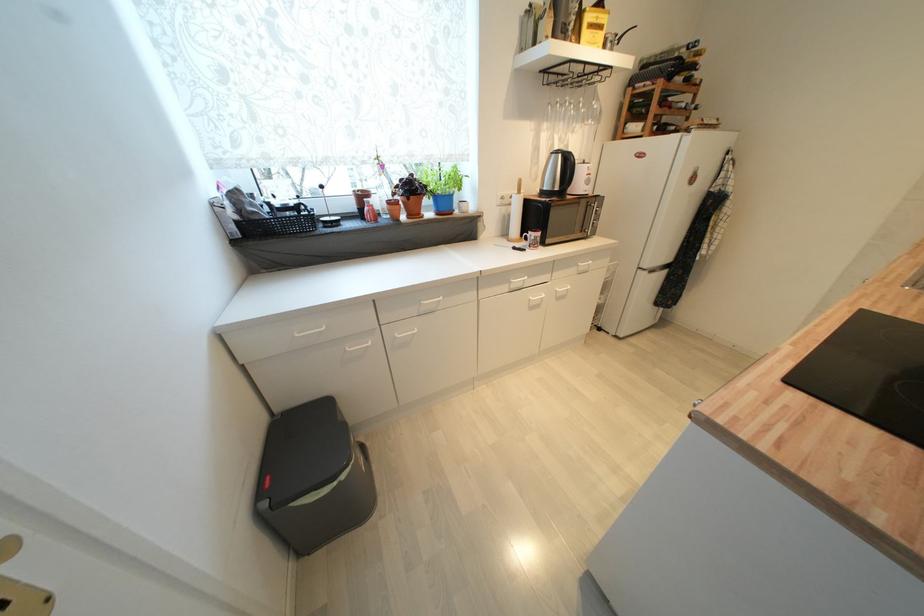
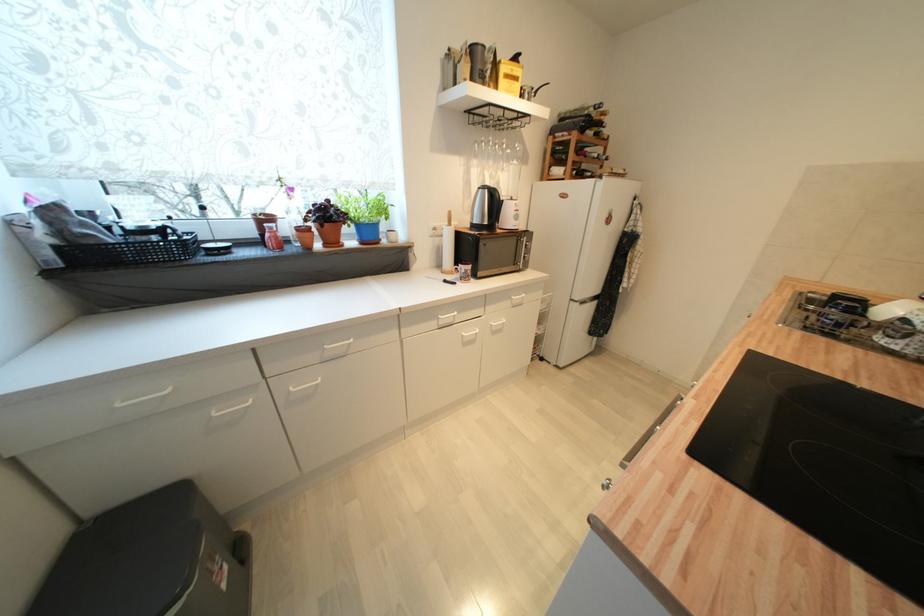
What movement of the cameraman would produce the second image?

The movement direction of the cameraman is right, forward.